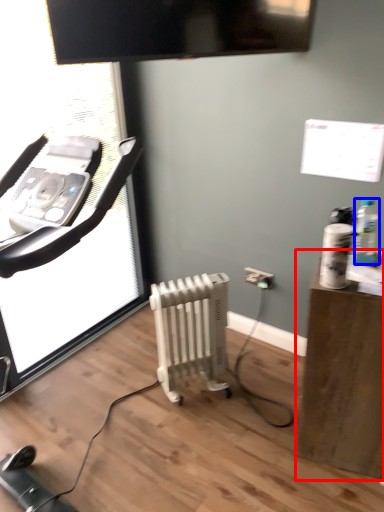
Question: Which object appears closest to the camera in this image, furniture (highlighted by a red box) or bottle (highlighted by a blue box)?

Choices:
 (A) furniture
 (B) bottle

Answer: (A)